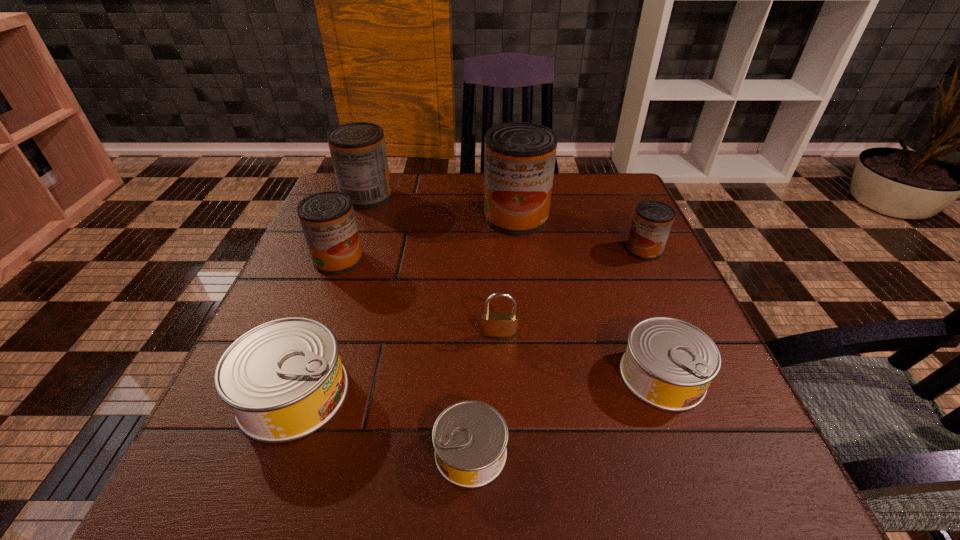
At what (x,y) coordinates should I click in order to perform the action: click on the tallest object. Please return your answer as a coordinate pair (x, y). The height and width of the screenshot is (540, 960). Looking at the image, I should click on (519, 157).

Locate an element on the screen. The image size is (960, 540). the second red can from right to left is located at coordinates (519, 157).

You are a GUI agent. You are given a task and a screenshot of the screen. Output one action in this format:
    pyautogui.click(x=<x>, y=<y>)
    Task: Click on the sixth shortest can
    
    Given the screenshot: What is the action you would take?
    pyautogui.click(x=358, y=151)

Image resolution: width=960 pixels, height=540 pixels. I want to click on the second biggest red can, so click(358, 151).

You are a GUI agent. You are given a task and a screenshot of the screen. Output one action in this format:
    pyautogui.click(x=<x>, y=<y>)
    Task: Click on the third tallest object
    
    Given the screenshot: What is the action you would take?
    pyautogui.click(x=328, y=222)

Identify the location of the second smallest red can. (328, 222).

The image size is (960, 540). What are the coordinates of `the fifth farthest object` in the screenshot? It's located at (497, 326).

You are a GUI agent. You are given a task and a screenshot of the screen. Output one action in this format:
    pyautogui.click(x=<x>, y=<y>)
    Task: Click on the padlock
    
    Given the screenshot: What is the action you would take?
    pyautogui.click(x=497, y=326)

Locate an element on the screen. Image resolution: width=960 pixels, height=540 pixels. the smallest red can is located at coordinates (652, 222).

This screenshot has width=960, height=540. What are the coordinates of `the biggest silver can` in the screenshot? It's located at (283, 380).